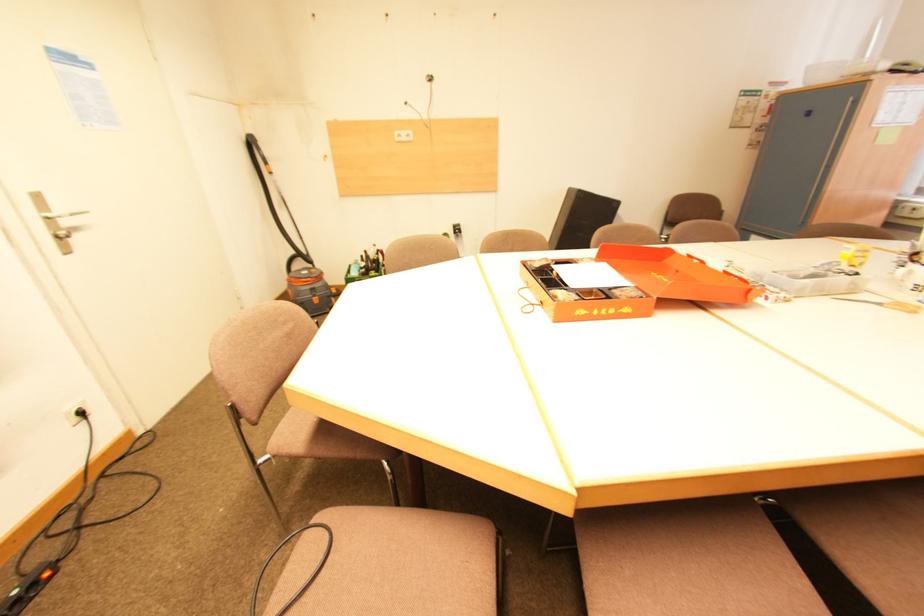
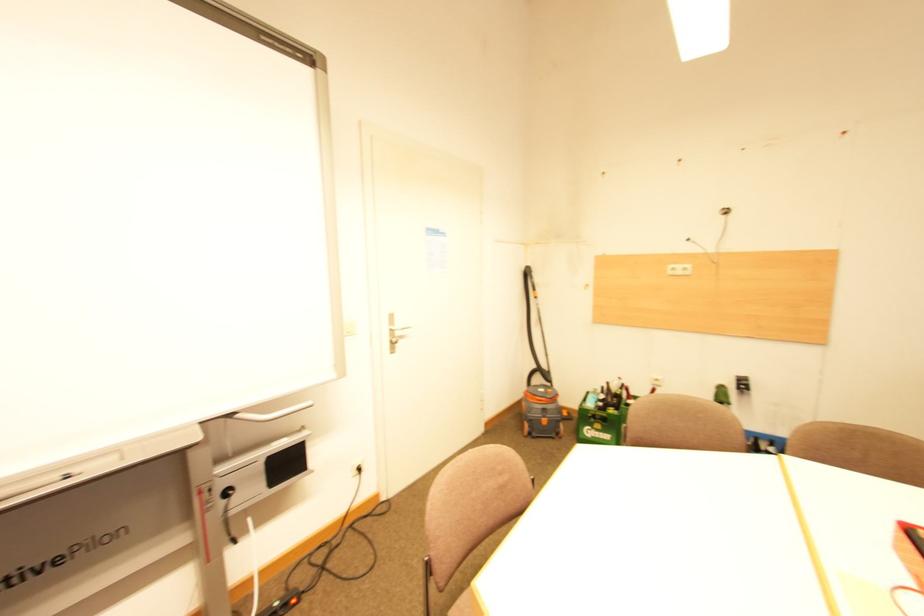
Question: The images are taken continuously from a first-person perspective. In which direction is your viewpoint rotating?

Choices:
 (A) Left
 (B) Right
 (C) Up
 (D) Down

Answer: (A)